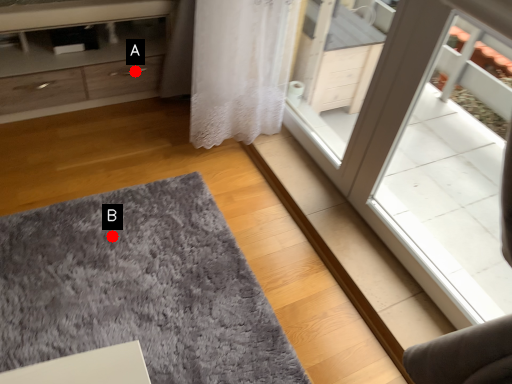
Question: Two points are circled on the image, labeled by A and B beside each circle. Which point appears closest to the camera in this image?

Choices:
 (A) A is closer
 (B) B is closer

Answer: (B)